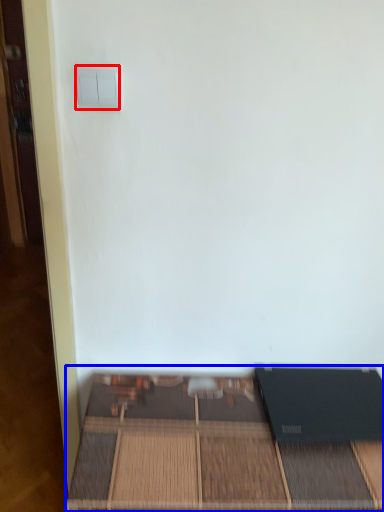
Question: Which object appears farthest to the camera in this image, light switch (highlighted by a red box) or furniture (highlighted by a blue box)?

Choices:
 (A) light switch
 (B) furniture

Answer: (B)